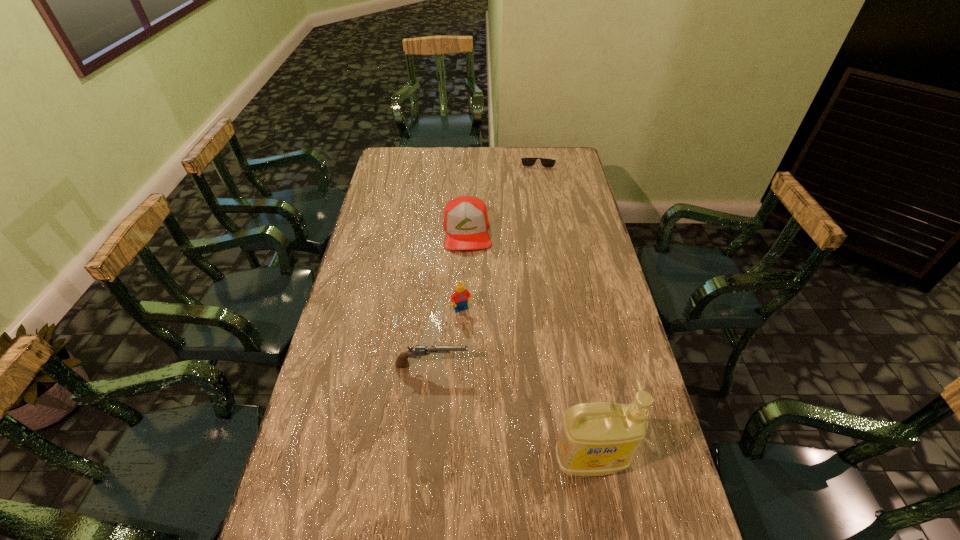
Where is `gun`? The image size is (960, 540). gun is located at coordinates (418, 350).

At what (x,y) coordinates should I click in order to perform the action: click on the fourth tallest object. Please return your answer as a coordinate pair (x, y). The width and height of the screenshot is (960, 540). Looking at the image, I should click on (418, 350).

You are a GUI agent. You are given a task and a screenshot of the screen. Output one action in this format:
    pyautogui.click(x=<x>, y=<y>)
    Task: Click on the tallest object
    The image size is (960, 540).
    Given the screenshot: What is the action you would take?
    pyautogui.click(x=599, y=438)

Where is `the nearest object`? The height and width of the screenshot is (540, 960). the nearest object is located at coordinates (599, 438).

Where is `baseball cap`? The width and height of the screenshot is (960, 540). baseball cap is located at coordinates click(x=466, y=223).

Locate an element on the screen. Image resolution: width=960 pixels, height=540 pixels. the third nearest object is located at coordinates (459, 298).

At what (x,y) coordinates should I click in order to perform the action: click on sunglasses. Please return your answer as a coordinate pair (x, y). Looking at the image, I should click on click(545, 162).

This screenshot has height=540, width=960. Identify the location of the farthest object. (545, 162).

This screenshot has height=540, width=960. I want to click on free space located 0.300m aiming along the barrel of the second shortest object, so click(571, 365).

You are a GUI agent. You are given a task and a screenshot of the screen. Output one action in this format:
    pyautogui.click(x=<x>, y=<y>)
    Task: Click on the vacant space located 0.070m on the back of the nearest object
    The height and width of the screenshot is (540, 960).
    Given the screenshot: What is the action you would take?
    pyautogui.click(x=582, y=415)